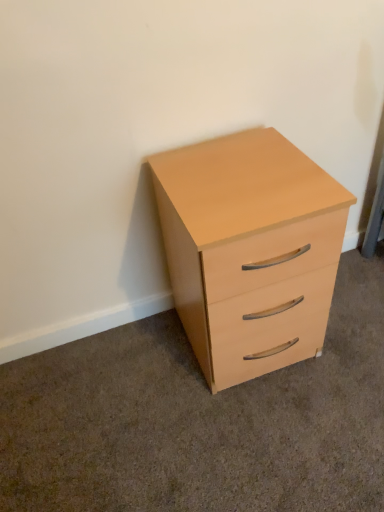
What is the approximate height of light wood/finish chest of drawers at center?

It is 26.50 inches.

Locate an element on the screen. The image size is (384, 512). light wood/finish chest of drawers at center is located at coordinates (247, 242).

The image size is (384, 512). What do you see at coordinates (247, 242) in the screenshot?
I see `light wood/finish chest of drawers at center` at bounding box center [247, 242].

You are a GUI agent. You are given a task and a screenshot of the screen. Output one action in this format:
    pyautogui.click(x=<x>, y=<y>)
    Task: Click on the light wood/finish chest of drawers at center
    
    Given the screenshot: What is the action you would take?
    pyautogui.click(x=247, y=242)